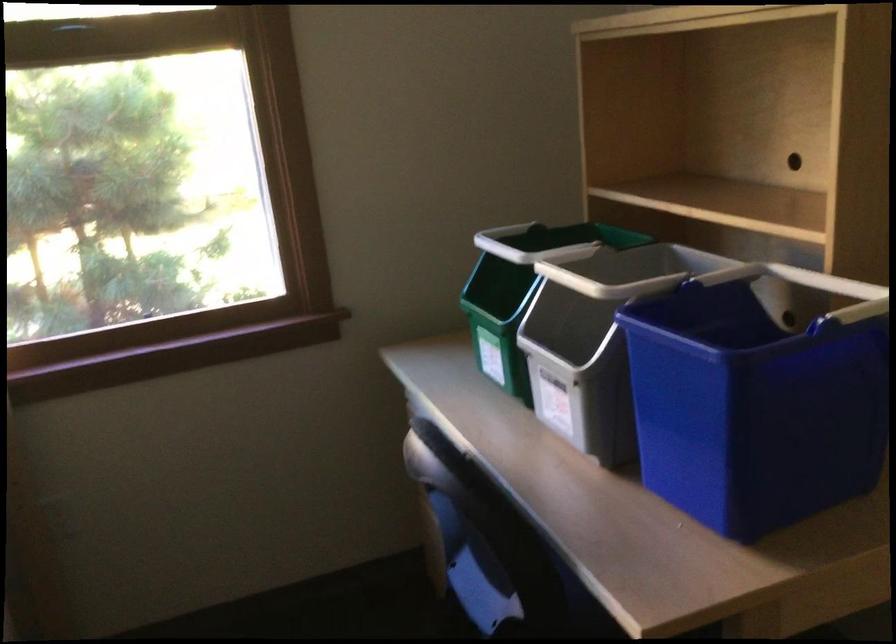
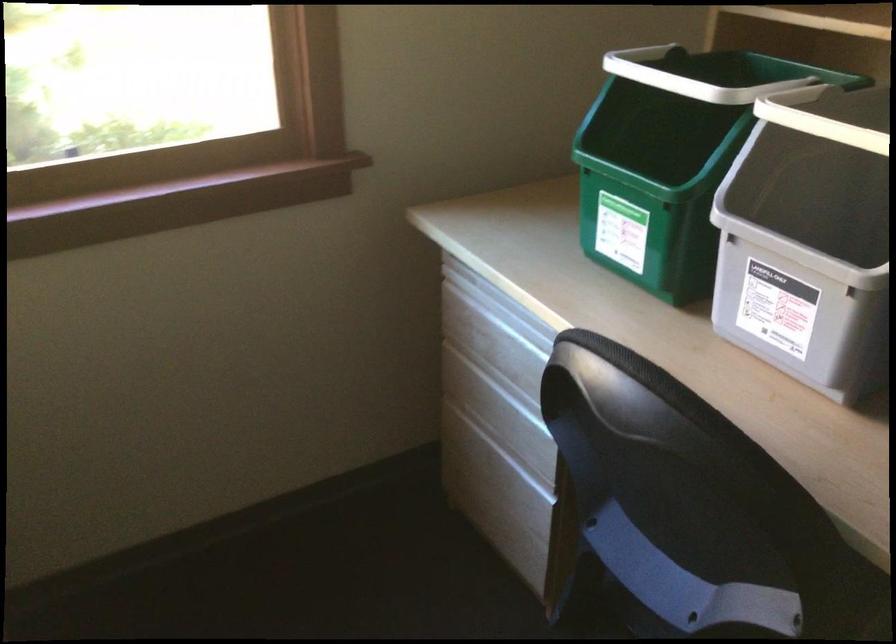
The point at (494, 328) is marked in the first image. Where is the corresponding point in the second image?

(652, 194)